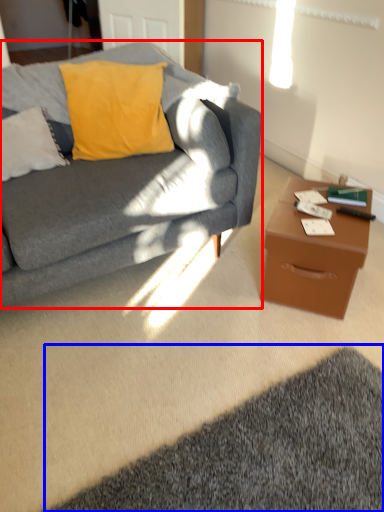
Question: Which of the following is the farthest to the observer, studio couch (highlighted by a red box) or mat (highlighted by a blue box)?

Choices:
 (A) studio couch
 (B) mat

Answer: (A)